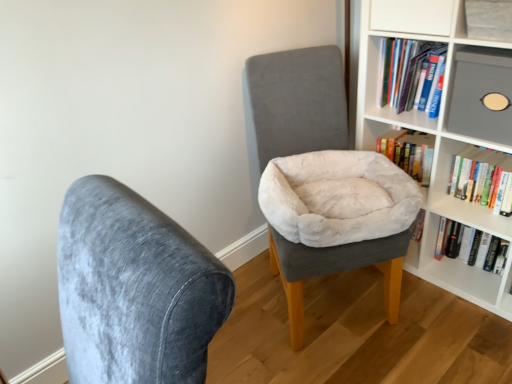
Locate an element on the screen. free space above hardcover book at upper right, which is counted as the 2th book, starting from the bottom (from a real-world perspective) is located at coordinates (488, 157).